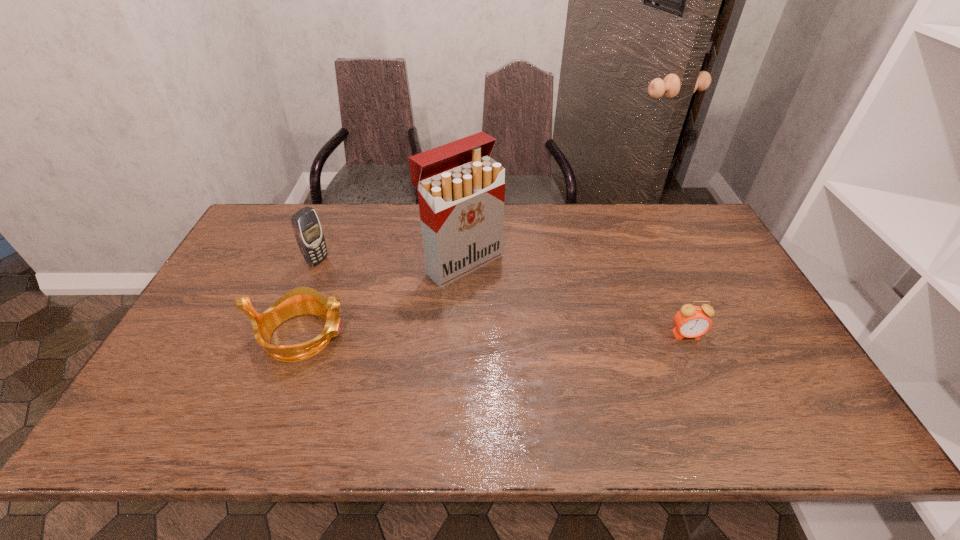
At what (x,y) coordinates should I click in order to perform the action: click on tiara. Please return your answer as a coordinate pair (x, y). The image size is (960, 540). Looking at the image, I should click on (303, 300).

Locate an element on the screen. This screenshot has height=540, width=960. the rightmost object is located at coordinates (691, 321).

This screenshot has height=540, width=960. I want to click on cellular telephone, so click(307, 229).

Find the location of `the third object from left to right`. the third object from left to right is located at coordinates (461, 190).

Identify the location of the tallest object. (461, 190).

Locate an element on the screen. This screenshot has width=960, height=540. free space located at the front emblem of the tiara is located at coordinates (488, 335).

Image resolution: width=960 pixels, height=540 pixels. What are the coordinates of `free region located 0.170m on the face of the alarm clock` in the screenshot? It's located at (714, 399).

You are a GUI agent. You are given a task and a screenshot of the screen. Output one action in this format:
    pyautogui.click(x=<x>, y=<y>)
    Task: Click on the free point located on the front face of the cellular telephone
    This screenshot has width=960, height=540.
    Given the screenshot: What is the action you would take?
    pyautogui.click(x=372, y=287)

This screenshot has width=960, height=540. In order to click on free space located 0.200m on the front face of the cellular telephone in this screenshot , I will do `click(375, 288)`.

Identify the location of free space located 0.320m on the front face of the cellular telephone. (409, 302).